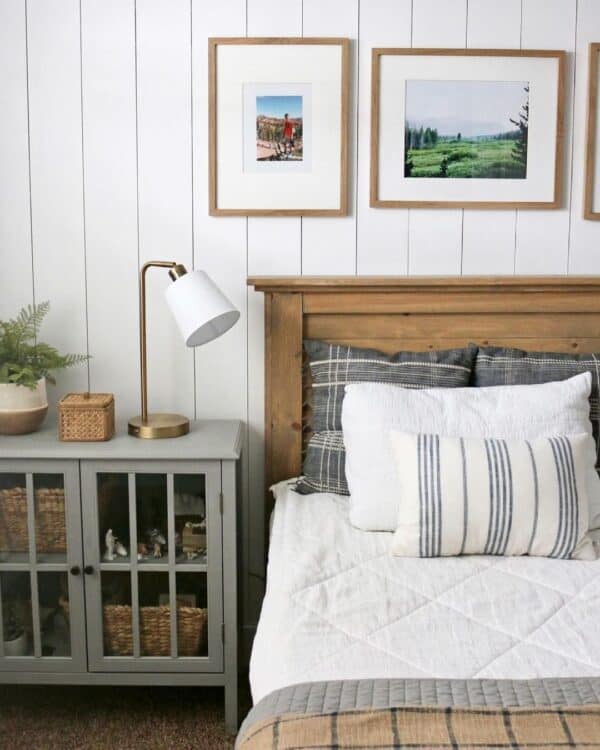
The width and height of the screenshot is (600, 750). Find the location of `bed`. bed is located at coordinates (472, 594).